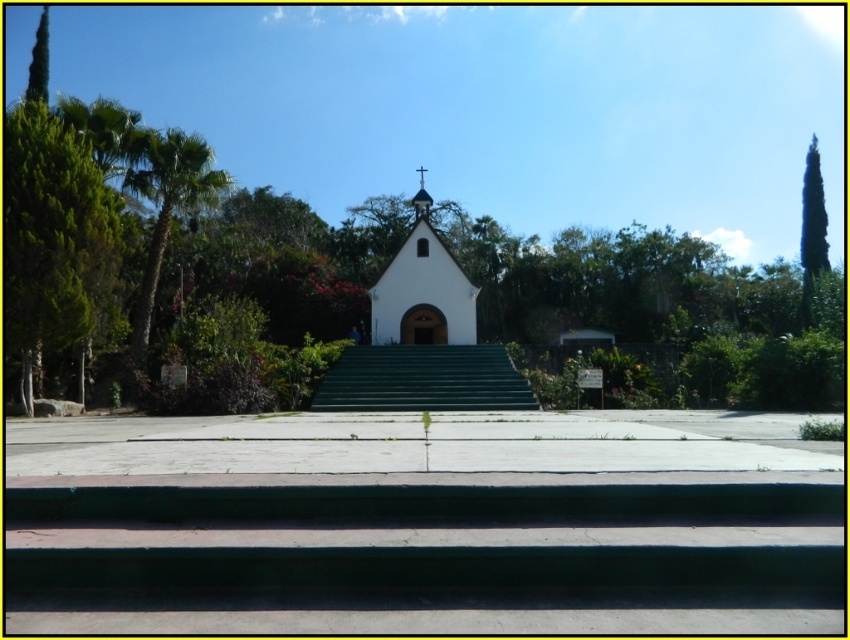
Is green concrete stairs at center thinner than white matte chapel at center?

In fact, green concrete stairs at center might be wider than white matte chapel at center.

Does green concrete stairs at center have a greater width compared to white matte chapel at center?

Yes, green concrete stairs at center is wider than white matte chapel at center.

Is point (421, 353) more distant than point (411, 307)?

No, (421, 353) is closer to viewer.

At what (x,y) coordinates should I click in order to perform the action: click on green concrete stairs at center. Please return your answer as a coordinate pair (x, y). Looking at the image, I should click on (423, 380).

Can you confirm if green leafy tree at upper right is shorter than metallic cross at upper center?

No, green leafy tree at upper right is not shorter than metallic cross at upper center.

The height and width of the screenshot is (640, 850). I want to click on green leafy tree at upper right, so click(812, 228).

Find the location of a particular element. Image resolution: width=850 pixels, height=640 pixels. green leafy tree at upper right is located at coordinates (812, 228).

Does point (81, 499) come in front of point (805, 316)?

Yes, point (81, 499) is closer to viewer.

Is concrete steps at center thinner than green leafy tree at upper right?

Indeed, concrete steps at center has a lesser width compared to green leafy tree at upper right.

Does point (646, 492) lie in front of point (820, 252)?

Yes, point (646, 492) is in front of point (820, 252).

Where is `concrete steps at center`? This screenshot has width=850, height=640. concrete steps at center is located at coordinates (425, 538).